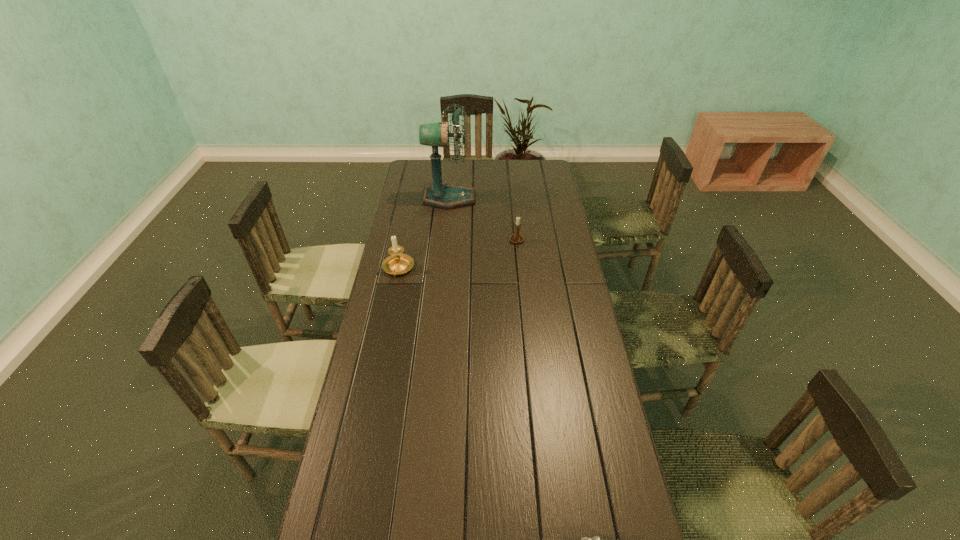
This screenshot has width=960, height=540. I want to click on candle holder located in the left edge section of the desktop, so click(x=398, y=263).

In the image, there is a desktop. Identify the location of vacant space at the far edge. Image resolution: width=960 pixels, height=540 pixels. (511, 171).

Where is `vacant position at the left edge of the desktop`? The image size is (960, 540). vacant position at the left edge of the desktop is located at coordinates (395, 324).

This screenshot has height=540, width=960. Find the location of `vacant space at the right edge of the desktop`. vacant space at the right edge of the desktop is located at coordinates (551, 274).

Identify the location of vacant space at the far left corner of the desktop. The height and width of the screenshot is (540, 960). 431,170.

What are the coordinates of `free area in between the third nearest object and the taller candle holder` in the screenshot? It's located at (458, 255).

Find the location of a particular element. The width and height of the screenshot is (960, 540). vacant space in between the fan and the third farthest object is located at coordinates (423, 234).

The width and height of the screenshot is (960, 540). Find the location of `vacant area that lies between the taller candle holder and the second shortest object`. vacant area that lies between the taller candle holder and the second shortest object is located at coordinates (458, 255).

This screenshot has width=960, height=540. Identify the location of free space that is in between the farthest object and the shorter candle holder. (483, 220).

Find the location of `vacant region between the third shortest object and the second shortest object`. vacant region between the third shortest object and the second shortest object is located at coordinates (458, 255).